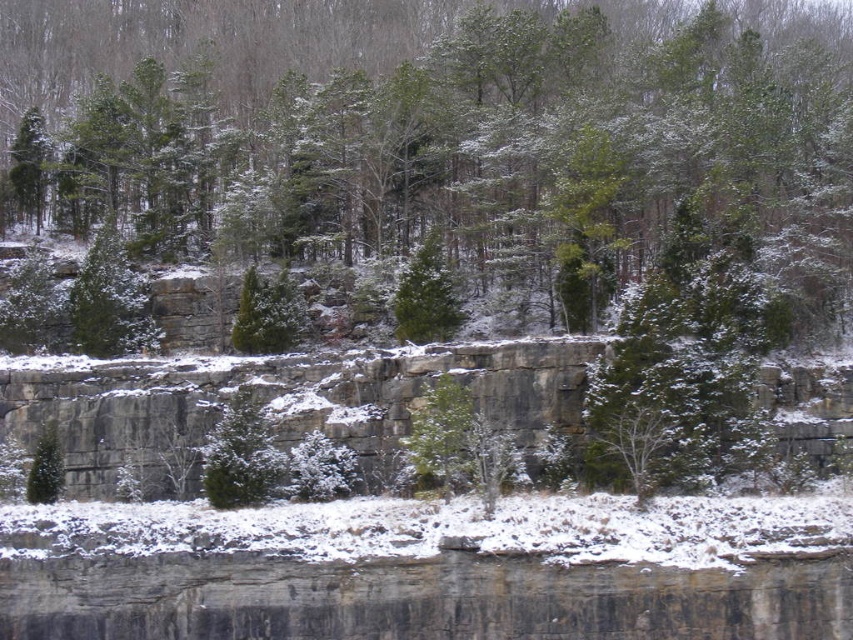
You are a hiker standing at the base of the gray rock cliff at center. You want to climb to the top of the cliff. If your climbing gear can handle a maximum height of 50 meters, will you be able to safely reach the top?

The gray rock cliff at center is 47.12 meters from camera, which is within your gear limit of 50 meters. Yes, you can safely climb to the top.

You are standing at the base of the cliff in the winter scene. There is a specific point marked at coordinates (277, 403). Can you tell me what object this point is pointing to?

The point at (277, 403) corresponds to the gray rock cliff at center.